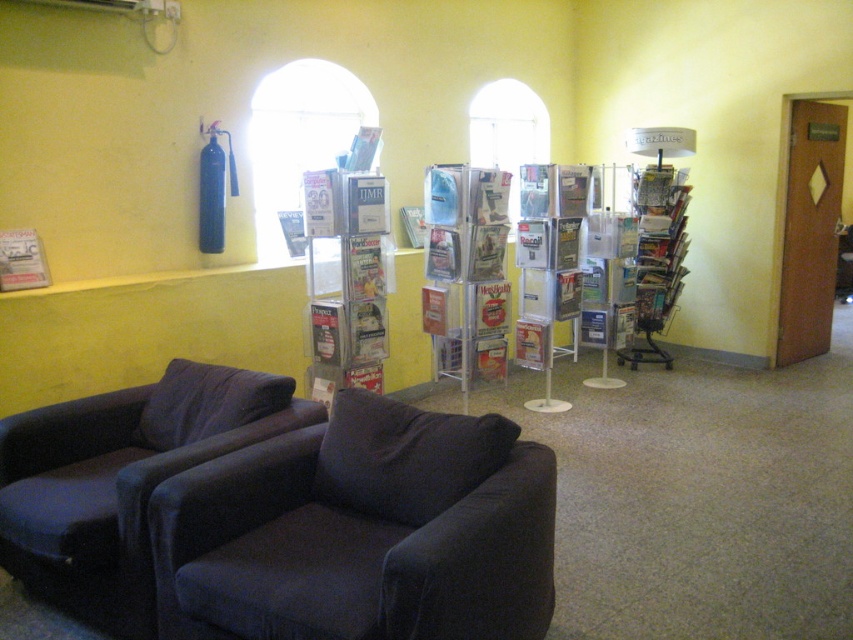
You are standing at point (30, 252) and want to walk to the sofa. Is the sofa located in front of or behind the point (508, 420)?

The sofa is located in front of point (508, 420) because point (508, 420) is in front of point (30, 252) where you are standing.

You are organizing a childrens reading event and need to place a 30cm wide stuffed animal on the largest available object in the scene. Which object should you choose between the dark blue fabric armchair at lower left and the matte paper magazine at left?

The dark blue fabric armchair at lower left is bigger than the matte paper magazine at left, so you should place the 30cm wide stuffed animal on the dark blue fabric armchair at lower left.